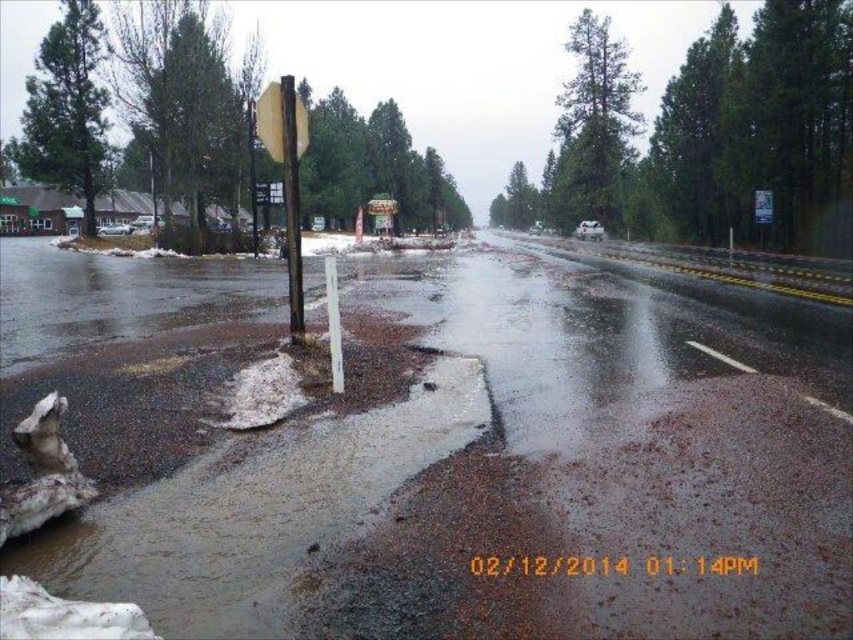
Which is more to the left, brown mud at lower left or yellow matte stop sign at upper center?

yellow matte stop sign at upper center

Does brown mud at lower left have a larger size compared to yellow matte stop sign at upper center?

Indeed, brown mud at lower left has a larger size compared to yellow matte stop sign at upper center.

Who is more distant from viewer, (654, 273) or (281, 182)?

The point (281, 182) is behind.

At what (x,y) coordinates should I click in order to perform the action: click on brown mud at lower left. Please return your answer as a coordinate pair (x, y). Looking at the image, I should click on (618, 458).

Does metallic pole at center have a greater height compared to yellow matte stop sign at upper center?

Yes.

Does metallic pole at center appear under yellow matte stop sign at upper center?

Correct, metallic pole at center is located below yellow matte stop sign at upper center.

Who is more distant from viewer, (299,282) or (256,196)?

Point (256,196)

You are a GUI agent. You are given a task and a screenshot of the screen. Output one action in this format:
    pyautogui.click(x=<x>, y=<y>)
    Task: Click on the metallic pole at center
    Image resolution: width=853 pixels, height=640 pixels.
    Given the screenshot: What is the action you would take?
    pyautogui.click(x=291, y=205)

How much distance is there between brown mud at lower left and metallic pole at center?

They are 116.35 meters apart.

Is the position of brown mud at lower left more distant than that of metallic pole at center?

No.

The width and height of the screenshot is (853, 640). Find the location of `brown mud at lower left`. brown mud at lower left is located at coordinates (618, 458).